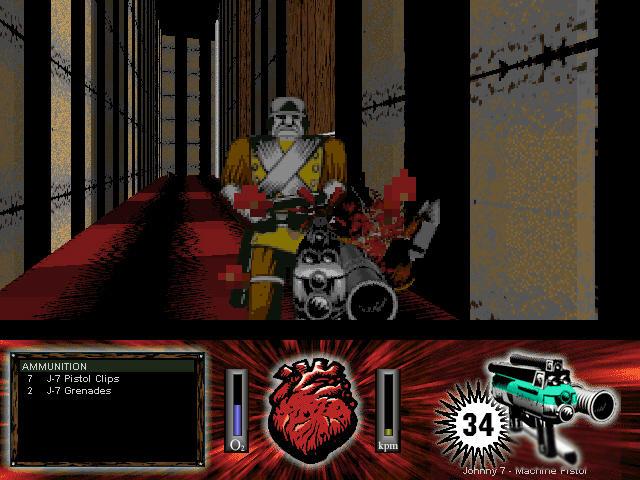
What are the coordinates of `window` in the screenshot? It's located at (138, 434).